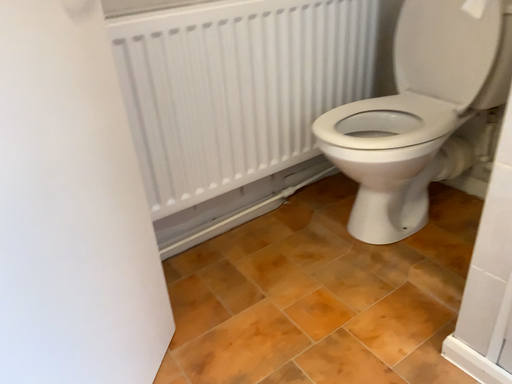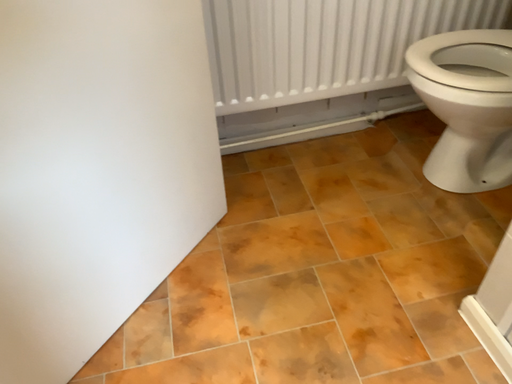
Question: How did the camera likely rotate when shooting the video?

Choices:
 (A) rotated upward
 (B) rotated downward

Answer: (B)